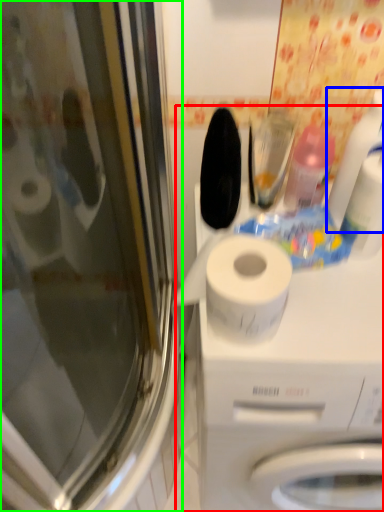
Question: Based on their relative distances, which object is nearer to machine (highlighted by a red box)? Choose from cleaning product (highlighted by a blue box) and screen door (highlighted by a green box).

Choices:
 (A) cleaning product
 (B) screen door

Answer: (A)